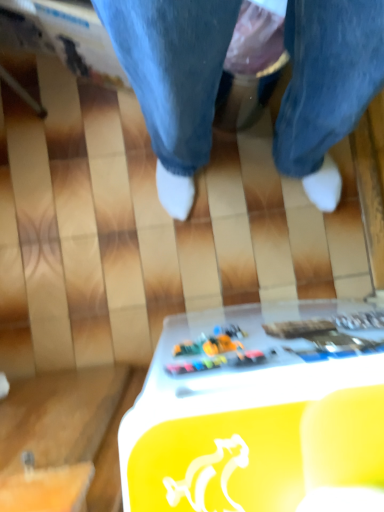
Question: Does white plastic table at lower center lie behind multicolored plastic toy at center, the second writing from the right?

Choices:
 (A) yes
 (B) no

Answer: (B)

Question: Does white plastic table at lower center come in front of multicolored plastic toy at center, which is the 1th writing from left to right?

Choices:
 (A) no
 (B) yes

Answer: (B)

Question: Is white plastic table at lower center shorter than multicolored plastic toy at center, which is the 1th writing from left to right?

Choices:
 (A) yes
 (B) no

Answer: (B)

Question: Does white plastic table at lower center have a smaller size compared to multicolored plastic toy at center, the second writing from the right?

Choices:
 (A) no
 (B) yes

Answer: (A)

Question: Is white plastic table at lower center not close to multicolored plastic toy at center, the second writing from the right?

Choices:
 (A) no
 (B) yes

Answer: (A)

Question: Is white plastic table at lower center to the left of multicolored plastic toy at center, which is the 1th writing from left to right, from the viewer's perspective?

Choices:
 (A) yes
 (B) no

Answer: (B)

Question: Is multicolored plastic toy at center, the second writing from the right, taller than white plastic table at lower center?

Choices:
 (A) no
 (B) yes

Answer: (A)

Question: From the image's perspective, is multicolored plastic toy at center, which is the 1th writing from left to right, above white plastic table at lower center?

Choices:
 (A) no
 (B) yes

Answer: (B)

Question: Are multicolored plastic toy at center, which is the 1th writing from left to right, and white plastic table at lower center making contact?

Choices:
 (A) no
 (B) yes

Answer: (B)

Question: Could you tell me if multicolored plastic toy at center, the second writing from the right, is turned towards white plastic table at lower center?

Choices:
 (A) yes
 (B) no

Answer: (A)

Question: From a real-world perspective, is multicolored plastic toy at center, the second writing from the right, positioned over white plastic table at lower center based on gravity?

Choices:
 (A) yes
 (B) no

Answer: (A)

Question: Considering the relative positions of multicolored plastic toy at center, which is the 1th writing from left to right, and white plastic table at lower center in the image provided, is multicolored plastic toy at center, which is the 1th writing from left to right, in front of white plastic table at lower center?

Choices:
 (A) no
 (B) yes

Answer: (A)

Question: Is white plastic table at lower center positioned in front of metallic gold text at lower center, which is counted as the 2th writing, starting from the left?

Choices:
 (A) no
 (B) yes

Answer: (B)